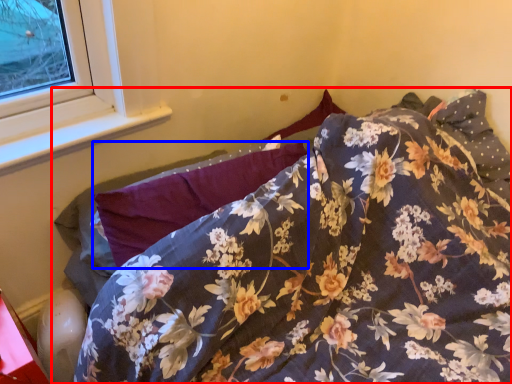
Question: Which object is further to the camera taking this photo, bed (highlighted by a red box) or pillow (highlighted by a blue box)?

Choices:
 (A) bed
 (B) pillow

Answer: (B)